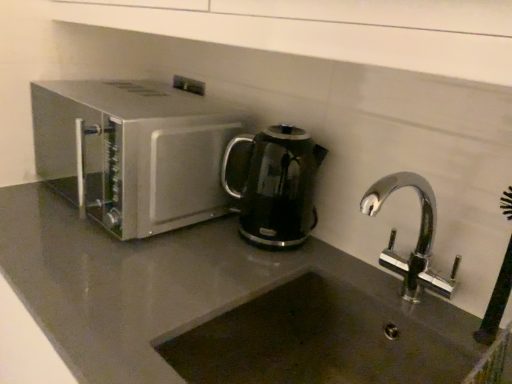
Where is `dark gray stone sink at lower center`? This screenshot has width=512, height=384. dark gray stone sink at lower center is located at coordinates (332, 338).

At what (x,y) coordinates should I click in order to perform the action: click on black glossy electric kettle at center. Please return your answer as a coordinate pair (x, y). The image size is (512, 384). Looking at the image, I should click on (277, 186).

This screenshot has height=384, width=512. I want to click on satin silver microwave at left, so click(x=133, y=152).

Which is further, (307, 166) or (498, 351)?

The point (307, 166) is farther.

From a real-world perspective, is black glossy electric kettle at center positioned above or below dark gray stone sink at lower center?

Clearly, from a real-world perspective, black glossy electric kettle at center is above dark gray stone sink at lower center.

How distant is black glossy electric kettle at center from dark gray stone sink at lower center?

black glossy electric kettle at center and dark gray stone sink at lower center are 8.74 inches apart from each other.

Consider the image. Could you tell me if black glossy electric kettle at center is turned towards dark gray stone sink at lower center?

No.

Based on the photo, which object is closer to the camera, dark gray stone sink at lower center or satin silver microwave at left?

Positioned in front is dark gray stone sink at lower center.

Is dark gray stone sink at lower center not near satin silver microwave at left?

No.

From the picture: Is dark gray stone sink at lower center bigger or smaller than satin silver microwave at left?

Clearly, dark gray stone sink at lower center is smaller in size than satin silver microwave at left.

Does dark gray stone sink at lower center turn towards satin silver microwave at left?

No, dark gray stone sink at lower center is not oriented towards satin silver microwave at left.

From a real-world perspective, relative to satin silver microwave at left, is black glossy electric kettle at center vertically above or below?

Clearly, from a real-world perspective, black glossy electric kettle at center is below satin silver microwave at left.

Which is more to the right, black glossy electric kettle at center or satin silver microwave at left?

black glossy electric kettle at center is more to the right.

The height and width of the screenshot is (384, 512). Find the location of `home appliance in front of the black glossy electric kettle at center`. home appliance in front of the black glossy electric kettle at center is located at coordinates (133, 152).

Measure the distance from black glossy electric kettle at center to satin silver microwave at left.

black glossy electric kettle at center is 9.22 inches away from satin silver microwave at left.

Between satin silver microwave at left and dark gray stone sink at lower center, which one has smaller width?

satin silver microwave at left.

At what (x,y) coordinates should I click in order to perform the action: click on sink below the satin silver microwave at left (from the image's perspective). Please return your answer as a coordinate pair (x, y). The width and height of the screenshot is (512, 384). Looking at the image, I should click on (332, 338).

Could you tell me if satin silver microwave at left is turned towards dark gray stone sink at lower center?

No.

Considering the relative sizes of dark gray stone sink at lower center and black glossy electric kettle at center in the image provided, is dark gray stone sink at lower center smaller than black glossy electric kettle at center?

Incorrect, dark gray stone sink at lower center is not smaller in size than black glossy electric kettle at center.

Which is more to the left, dark gray stone sink at lower center or black glossy electric kettle at center?

From the viewer's perspective, black glossy electric kettle at center appears more on the left side.

Between dark gray stone sink at lower center and black glossy electric kettle at center, which one has less height?

dark gray stone sink at lower center.

From the picture: Can you tell me how much dark gray stone sink at lower center and black glossy electric kettle at center differ in facing direction?

The angular difference between dark gray stone sink at lower center and black glossy electric kettle at center is 1.96 degrees.

Who is bigger, satin silver microwave at left or black glossy electric kettle at center?

Bigger between the two is satin silver microwave at left.

From a real-world perspective, between satin silver microwave at left and black glossy electric kettle at center, who is vertically higher?

satin silver microwave at left, from a real-world perspective.

Is satin silver microwave at left aimed at black glossy electric kettle at center?

No, satin silver microwave at left is not aimed at black glossy electric kettle at center.

Is satin silver microwave at left not close to black glossy electric kettle at center?

No, satin silver microwave at left is in close proximity to black glossy electric kettle at center.

This screenshot has height=384, width=512. Find the location of `sink below the black glossy electric kettle at center (from a real-world perspective)`. sink below the black glossy electric kettle at center (from a real-world perspective) is located at coordinates (332, 338).

Locate an element on the screen. sink below the satin silver microwave at left (from the image's perspective) is located at coordinates (332, 338).

Based on their spatial positions, is satin silver microwave at left or black glossy electric kettle at center further from dark gray stone sink at lower center?

satin silver microwave at left.

Based on their spatial positions, is black glossy electric kettle at center or satin silver microwave at left further from dark gray stone sink at lower center?

satin silver microwave at left is positioned further to the anchor dark gray stone sink at lower center.

Based on their spatial positions, is satin silver microwave at left or dark gray stone sink at lower center closer to black glossy electric kettle at center?

Based on the image, dark gray stone sink at lower center appears to be nearer to black glossy electric kettle at center.

When comparing their distances from black glossy electric kettle at center, does dark gray stone sink at lower center or satin silver microwave at left seem further?

Among the two, satin silver microwave at left is located further to black glossy electric kettle at center.

Looking at this image, estimate the real-world distances between objects in this image. Which object is closer to satin silver microwave at left, black glossy electric kettle at center or dark gray stone sink at lower center?

black glossy electric kettle at center is positioned closer to the anchor satin silver microwave at left.

When comparing their distances from satin silver microwave at left, does dark gray stone sink at lower center or black glossy electric kettle at center seem closer?

black glossy electric kettle at center is closer to satin silver microwave at left.

I want to click on kitchen appliance between satin silver microwave at left and dark gray stone sink at lower center from left to right, so click(x=277, y=186).